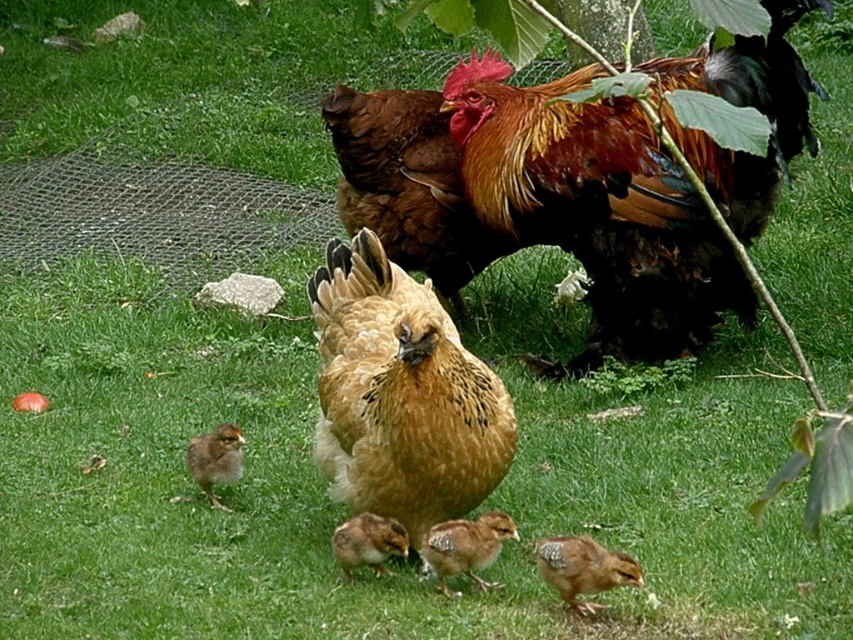
You are a photographer aiming to capture a closeup of the golden feathered hen at center and the brown speckled chick at lower left. Based on their positions, which one is located to the right of the other?

The golden feathered hen at center is positioned on the right side of brown speckled chick at lower left, so the hen is to the right of the chick.

Consider the image. You are a small insect in the grassy area and want to move from point A to point B. Point A is at coordinate point(x=570, y=566) and point B is at coordinate point(x=347, y=572). Which point is closer to you when you are at point A?

Point A is at coordinate point(x=570, y=566) and point B is at coordinate point(x=347, y=572). Since you are at point A, you are already there, so point A is closer.

You are a farmer who wants to place a fence around the golden feathered hen at center and the brown speckled chick at lower left. Which one requires a larger fence area to accommodate its size?

The golden feathered hen at center requires a larger fence area because its width is greater than the brown speckled chick at lower left.